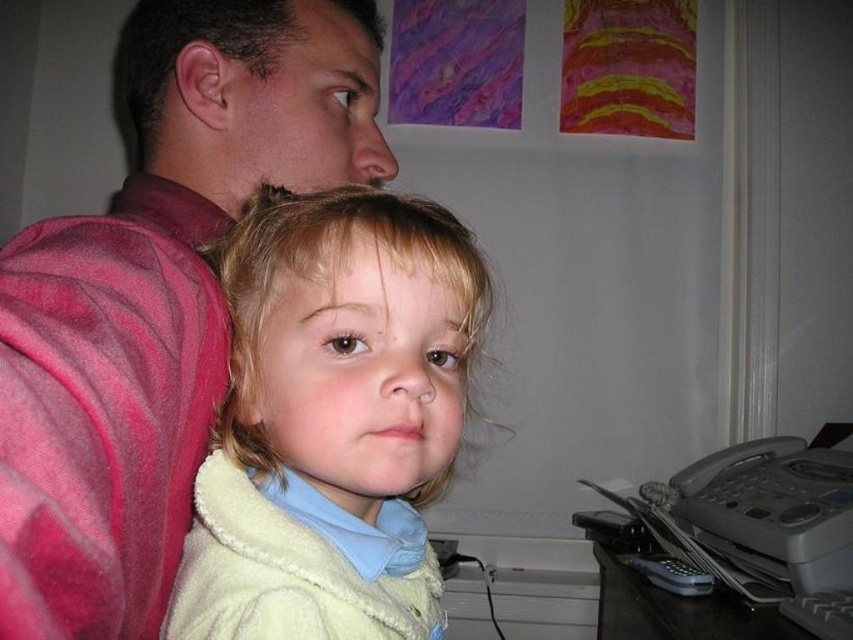
You are a photographer setting up a shoot in this room. You need to place a small prop between the matte pink shirt at upper left and the fluffy yellow jacket at center. Based on their positions, where should you place the prop so it is equidistant from both?

The matte pink shirt at upper left is closer to the viewer than the fluffy yellow jacket at center, so to place the prop equidistant between them, position it closer to the fluffy yellow jacket at center.